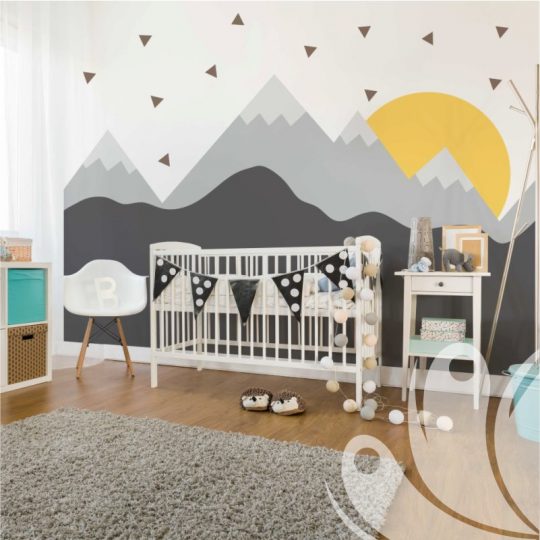
Identify the location of rug. The width and height of the screenshot is (540, 540). (220, 505).